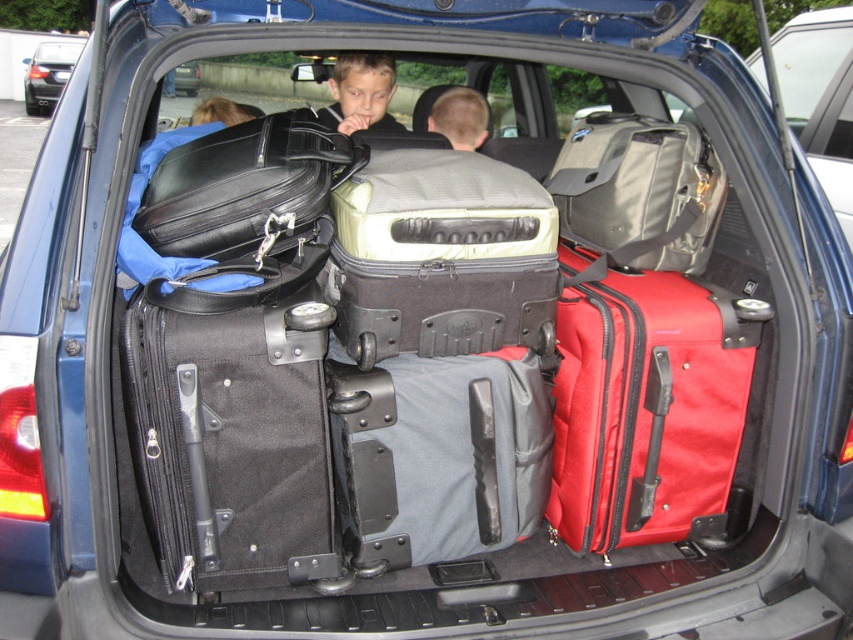
You are a photographer standing 6 feet away from the trunk of the blue station wagon. You want to take a clear photo of the black fabric suitcase at center without moving any luggage. Can you capture it in your current position?

The black fabric suitcase at center is 5.60 feet away from the camera, so yes, you can capture it clearly from your current position since you are only 6 feet away, which is within a reasonable distance for clear photography.

You are a travel agent helping a family pack their car trunk. They have a black fabric suitcase at center and a matte gray backpack at center. Which item should they place at the bottom of the trunk to ensure stability?

The black fabric suitcase at center is much taller than the matte gray backpack at center, so it should be placed at the bottom of the trunk for stability.

You are a delivery person trying to load a new package into the trunk of the metallic silver car at upper left. The package requires a space that is as wide as the black fabric suitcase at center. Is there enough space available in the trunk?

The black fabric suitcase at center is thinner than the metallic silver car at upper left, so the space available in the trunk of the metallic silver car at upper left is wider than the required width of the black fabric suitcase at center. Therefore, there is enough space to accommodate the package.